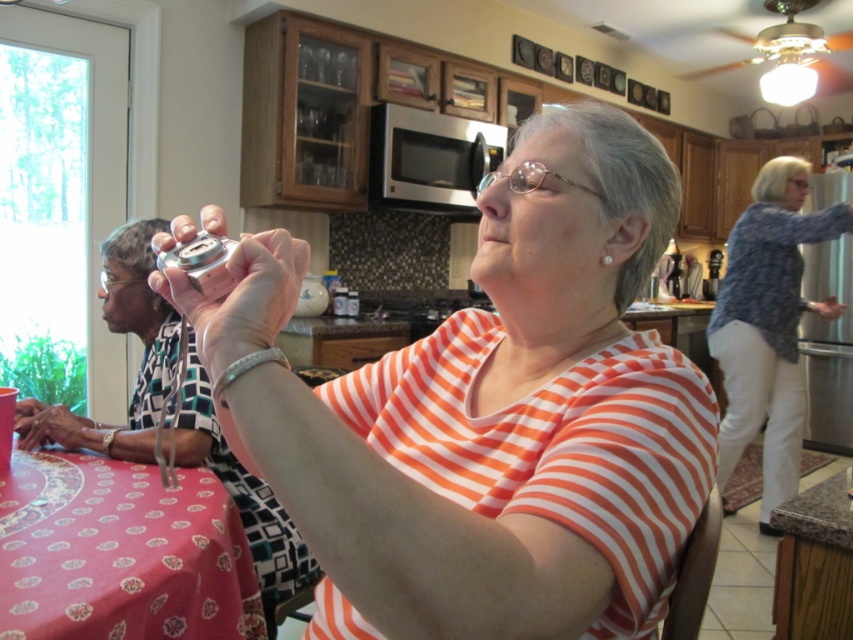
Is metallic silver can at center in front of pink fabric tablecloth at lower left?

That is True.

Based on the photo, between metallic silver can at center and pink fabric tablecloth at lower left, which one is positioned higher?

metallic silver can at center is above.

I want to click on metallic silver can at center, so click(488, 413).

Which is more to the right, metallic silver can at center or granite countertop at lower right?

granite countertop at lower right

Is metallic silver can at center to the right of granite countertop at lower right from the viewer's perspective?

Incorrect, metallic silver can at center is not on the right side of granite countertop at lower right.

Locate an element on the screen. The height and width of the screenshot is (640, 853). metallic silver can at center is located at coordinates click(488, 413).

In the scene shown: Which is above, blue textured sweater at right or metallic can at upper left?

blue textured sweater at right is above.

Is blue textured sweater at right above metallic can at upper left?

Indeed, blue textured sweater at right is positioned over metallic can at upper left.

Who is more forward, (788,451) or (102,433)?

Point (102,433) is in front.

Locate an element on the screen. Image resolution: width=853 pixels, height=640 pixels. blue textured sweater at right is located at coordinates (769, 324).